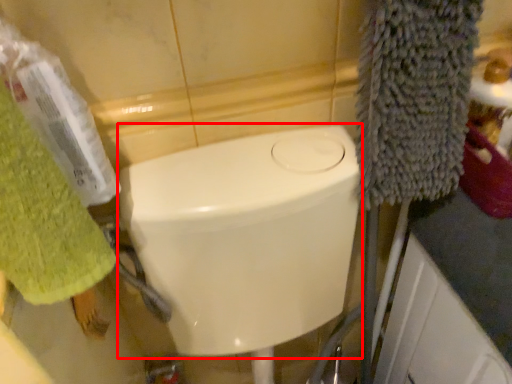
Question: Observing the image, what is the correct spatial positioning of bidet (annotated by the red box) in reference to towel/napkin?

Choices:
 (A) right
 (B) left

Answer: (A)